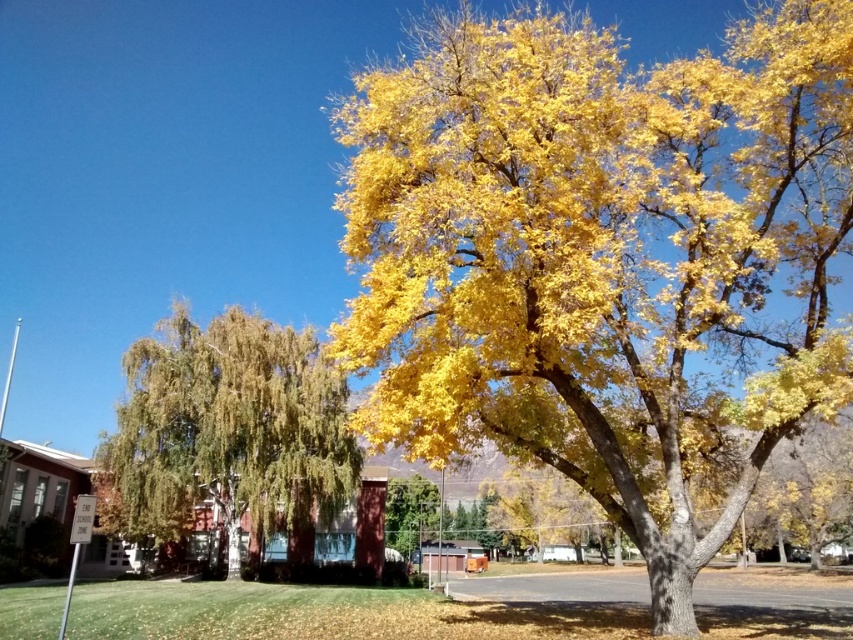
Does golden leafy tree at center appear on the right side of green leafy tree at left?

Indeed, golden leafy tree at center is positioned on the right side of green leafy tree at left.

Is golden leafy tree at center bigger than green leafy tree at left?

Indeed, golden leafy tree at center has a larger size compared to green leafy tree at left.

Is point (822, 102) more distant than point (251, 371)?

No, it is not.

This screenshot has height=640, width=853. I want to click on golden leafy tree at center, so click(602, 259).